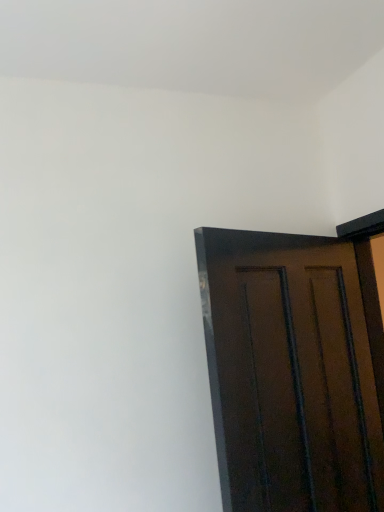
Locate an element on the screen. The height and width of the screenshot is (512, 384). dark wood door at right is located at coordinates (292, 372).

What do you see at coordinates (292, 372) in the screenshot? Image resolution: width=384 pixels, height=512 pixels. I see `dark wood door at right` at bounding box center [292, 372].

Locate an element on the screen. The image size is (384, 512). dark wood door at right is located at coordinates (292, 372).